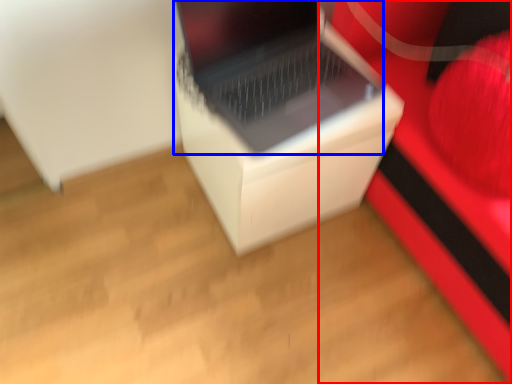
Question: Which object appears closest to the camera in this image, furniture (highlighted by a red box) or laptop (highlighted by a blue box)?

Choices:
 (A) furniture
 (B) laptop

Answer: (A)